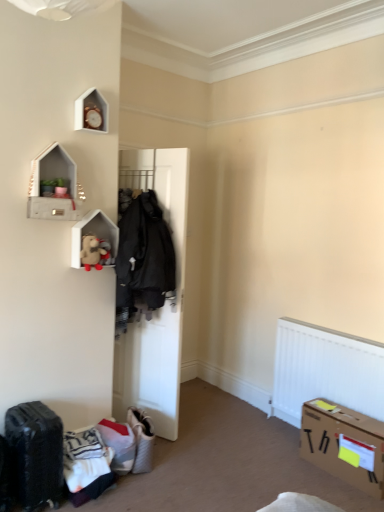
Locate an element on the screen. The height and width of the screenshot is (512, 384). free space in front of cardboard box at lower right is located at coordinates (345, 496).